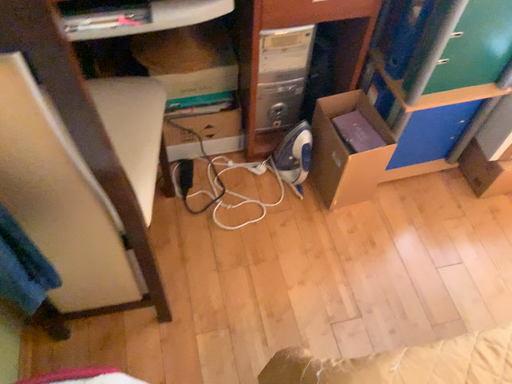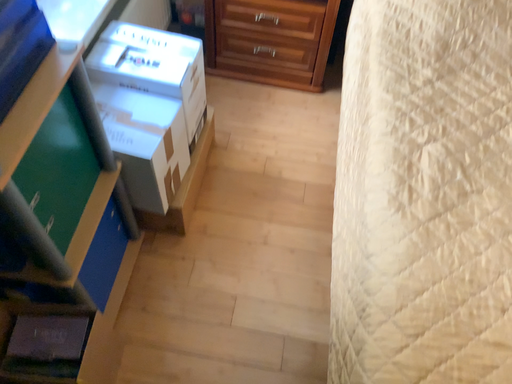
Question: How did the camera likely rotate when shooting the video?

Choices:
 (A) rotated upward
 (B) rotated downward

Answer: (A)